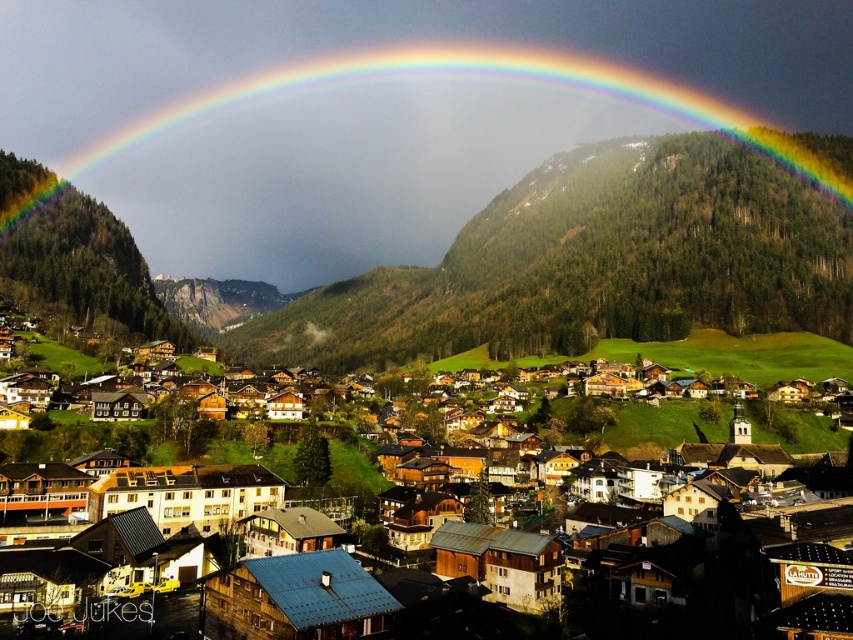
In the scene shown: Can you confirm if rainbow at upper center is thinner than wooden houses at center?

No, rainbow at upper center is not thinner than wooden houses at center.

Is point (447, 141) farther from camera compared to point (193, 392)?

Yes, it is behind point (193, 392).

In order to click on rainbow at upper center in this screenshot , I will do `click(378, 113)`.

What are the coordinates of `rainbow at upper center` in the screenshot? It's located at (378, 113).